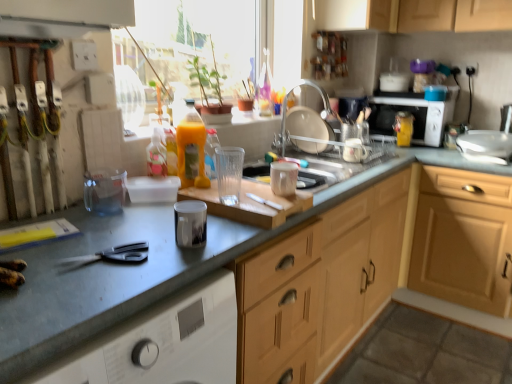
The image size is (512, 384). In order to click on blank space above metallic gray countertop at center-left, which ranks as the 2th countertop in right-to-left order (from a real-world perspective) in this screenshot , I will do `click(81, 246)`.